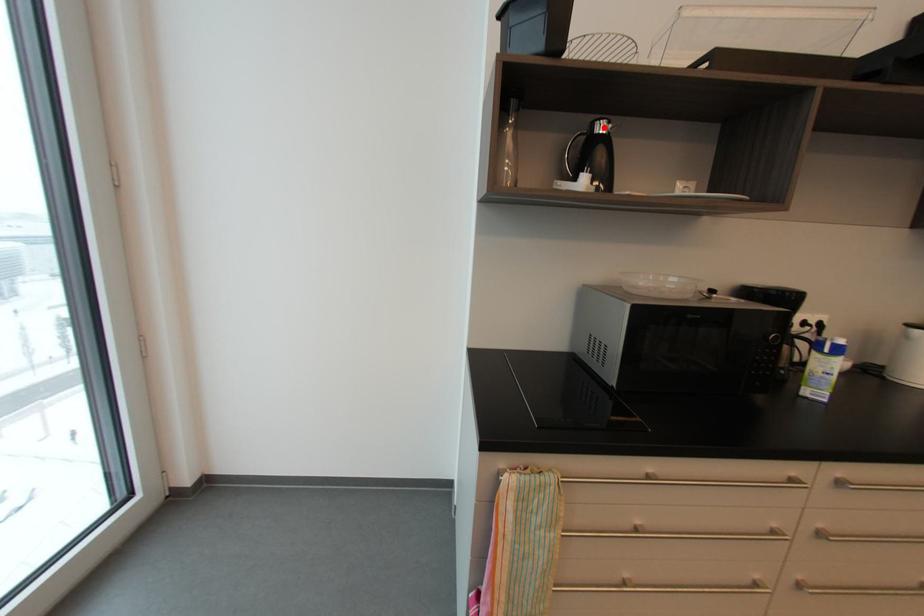
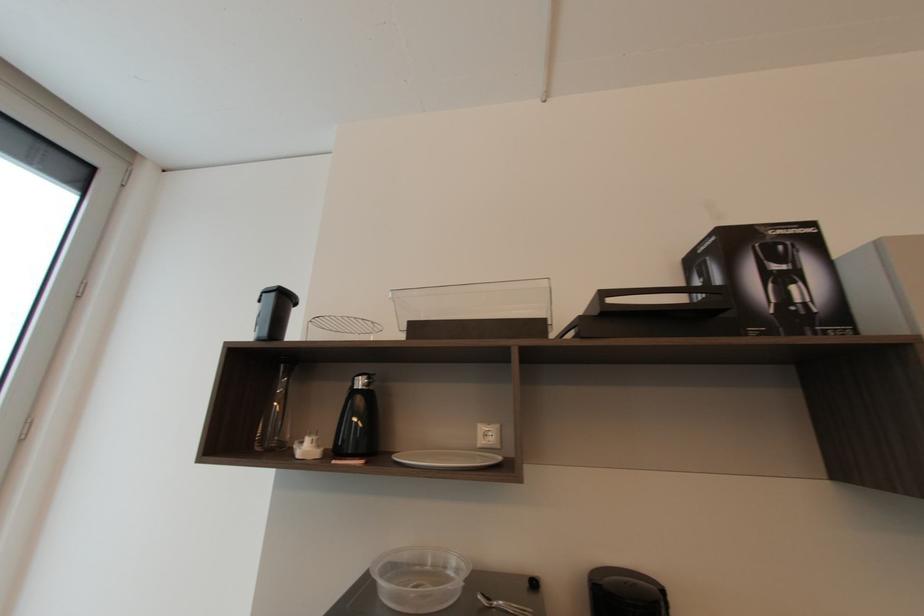
Locate, in the second image, the point that corresponds to the highlighted location in the first image.

(362, 384)